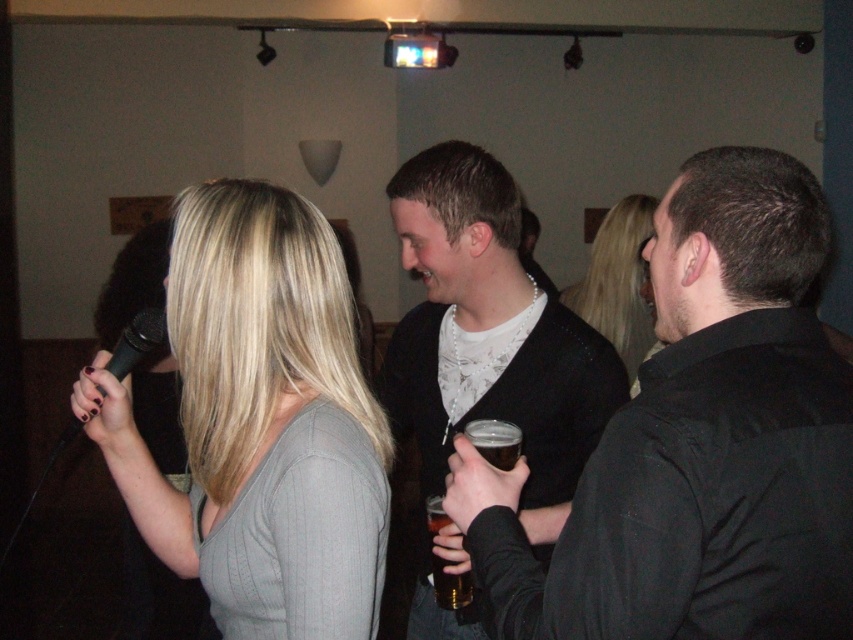
Question: Does black matte microphone at left appear on the right side of translucent glass beer at center?

Choices:
 (A) no
 (B) yes

Answer: (A)

Question: Based on their relative distances, which object is nearer to the black sweater at center?

Choices:
 (A) matte gray sweater at center
 (B) translucent glass beer at center

Answer: (B)

Question: Which object is positioned farthest from the translucent glass beer at center?

Choices:
 (A) translucent glass at upper center
 (B) black textured sweater at center
 (C) black sweater at center
 (D) black matte microphone at left

Answer: (D)

Question: Is black matte microphone at left thinner than translucent glass at upper center?

Choices:
 (A) no
 (B) yes

Answer: (A)

Question: Which of the following is the farthest from the observer?

Choices:
 (A) black sweater at center
 (B) blonde hair at center
 (C) black textured sweater at center

Answer: (B)

Question: Is black textured sweater at center wider than blonde hair at center?

Choices:
 (A) yes
 (B) no

Answer: (A)